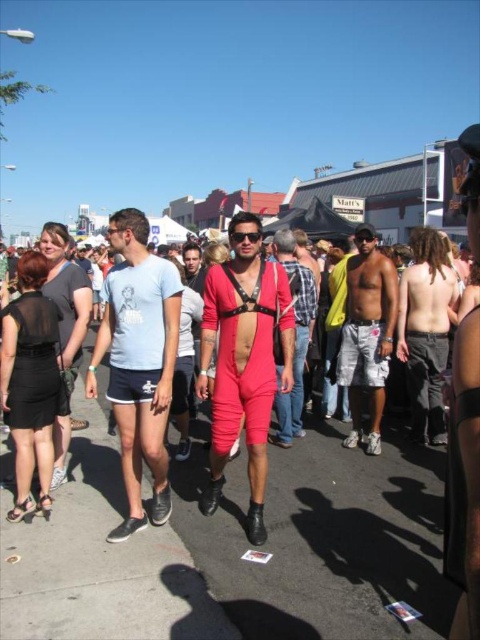
Who is taller, dark gray pants at center or black plastic goggles at center?

Standing taller between the two is dark gray pants at center.

Describe the element at coordinates (425, 330) in the screenshot. I see `dark gray pants at center` at that location.

At what (x,y) coordinates should I click in order to perform the action: click on dark gray pants at center. Please return your answer as a coordinate pair (x, y). Looking at the image, I should click on (425, 330).

Between point (218, 332) and point (355, 312), which one is positioned behind?

The point (355, 312) is behind.

Which is above, matte red jumpsuit at center or white cotton shorts at center?

white cotton shorts at center is above.

This screenshot has width=480, height=640. What do you see at coordinates (243, 365) in the screenshot?
I see `matte red jumpsuit at center` at bounding box center [243, 365].

I want to click on matte red jumpsuit at center, so click(x=243, y=365).

Can you confirm if rubberized red pants at center is positioned above dark gray pants at center?

Actually, rubberized red pants at center is below dark gray pants at center.

From the picture: Who is taller, rubberized red pants at center or dark gray pants at center?

dark gray pants at center

Is point (298, 532) behind point (439, 385)?

No.

Find the location of a particular element. rubberized red pants at center is located at coordinates (324, 540).